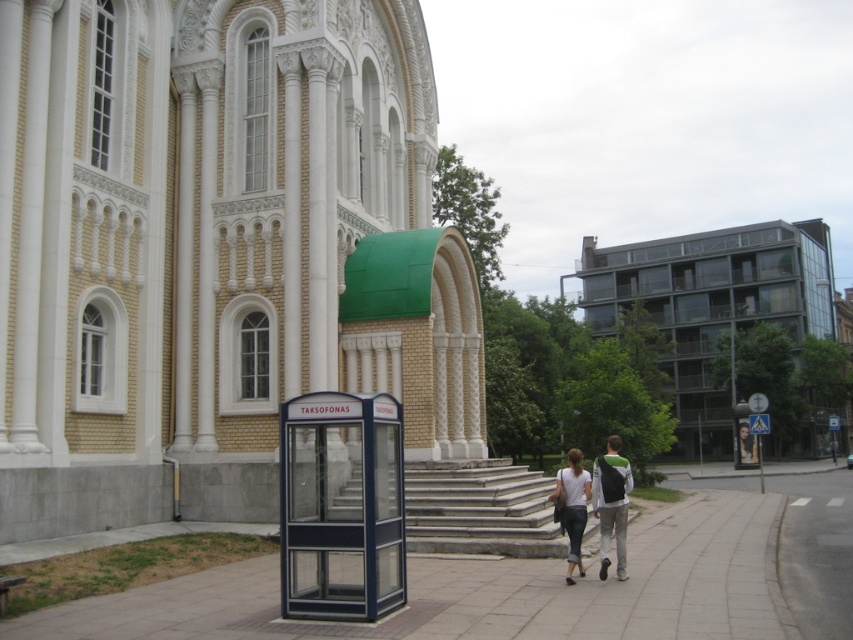
Between smooth concrete pavement at center and metallic blue booth at center, which one appears on the left side from the viewer's perspective?

Positioned to the left is metallic blue booth at center.

Who is positioned more to the right, smooth concrete pavement at center or metallic blue booth at center?

Positioned to the right is smooth concrete pavement at center.

Locate an element on the screen. This screenshot has width=853, height=640. smooth concrete pavement at center is located at coordinates (492, 592).

The image size is (853, 640). I want to click on smooth concrete pavement at center, so click(492, 592).

Who is positioned more to the right, metallic blue booth at center or white cotton shirt at center?

white cotton shirt at center

Where is `metallic blue booth at center`? The image size is (853, 640). metallic blue booth at center is located at coordinates (341, 506).

The height and width of the screenshot is (640, 853). I want to click on metallic blue booth at center, so click(x=341, y=506).

Does stone steps at center have a lesser width compared to white cotton shirt at center?

Yes.

Who is positioned more to the right, stone steps at center or white cotton shirt at center?

Positioned to the right is white cotton shirt at center.

At what (x,y) coordinates should I click in order to perform the action: click on stone steps at center. Please return your answer as a coordinate pair (x, y). The image size is (853, 640). Looking at the image, I should click on (480, 509).